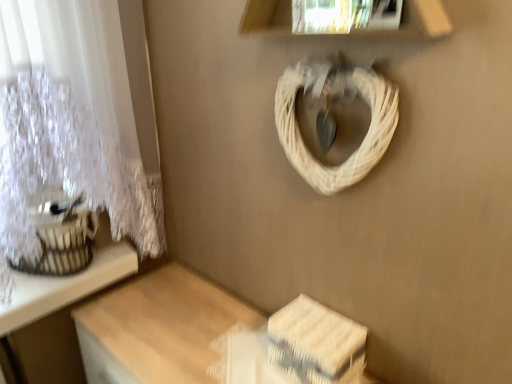
What do you see at coordinates (77, 121) in the screenshot? I see `white lace curtain at upper left` at bounding box center [77, 121].

Where is `wooden table at lower right`? This screenshot has width=512, height=384. wooden table at lower right is located at coordinates (158, 328).

This screenshot has height=384, width=512. What do you see at coordinates (158, 328) in the screenshot?
I see `wooden table at lower right` at bounding box center [158, 328].

Locate an element on the screen. This screenshot has height=384, width=512. white woven storage box at lower right is located at coordinates (316, 343).

I want to click on table to the right of white lace curtain at upper left, so click(158, 328).

How far apart are white lace curtain at upper left and wooden table at lower right?

white lace curtain at upper left is 37.15 centimeters from wooden table at lower right.

Is white lace curtain at upper left touching wooden table at lower right?

white lace curtain at upper left and wooden table at lower right are not in contact.

Can you tell me how much white lace curtain at upper left and wooden table at lower right differ in facing direction?

They differ by 91.7 degrees in their facing directions.

Is white lace curtain at upper left facing towards white woven storage box at lower right?

Yes, white lace curtain at upper left is turned towards white woven storage box at lower right.

Is white lace curtain at upper left not close to white woven storage box at lower right?

No.

Which is behind, white lace curtain at upper left or white woven storage box at lower right?

Positioned behind is white woven storage box at lower right.

Considering the sizes of objects white lace curtain at upper left and white woven storage box at lower right in the image provided, who is taller, white lace curtain at upper left or white woven storage box at lower right?

white lace curtain at upper left.

Is white wicker basket at upper center positioned far away from white lace curtain at upper left?

They are positioned close to each other.

Based on the photo, from the image's perspective, is white wicker basket at upper center on top of white lace curtain at upper left?

Yes, from the image's perspective, white wicker basket at upper center is above white lace curtain at upper left.

Where is `curtain on the left of white wicker basket at upper center`? This screenshot has height=384, width=512. curtain on the left of white wicker basket at upper center is located at coordinates (77, 121).

Considering the relative sizes of white wicker basket at upper center and white lace curtain at upper left in the image provided, is white wicker basket at upper center taller than white lace curtain at upper left?

Incorrect, the height of white wicker basket at upper center is not larger of that of white lace curtain at upper left.

Considering the sizes of objects white lace curtain at upper left and white wicker basket at upper center in the image provided, who is shorter, white lace curtain at upper left or white wicker basket at upper center?

white wicker basket at upper center is shorter.

Is the position of white lace curtain at upper left less distant than that of white wicker basket at upper center?

Yes, white lace curtain at upper left is in front of white wicker basket at upper center.

Considering the points (50, 92) and (376, 145), which point is in front, point (50, 92) or point (376, 145)?

The point (376, 145) is in front.

Considering the positions of objects white lace curtain at upper left and white wicker basket at upper center in the image provided, who is more to the right, white lace curtain at upper left or white wicker basket at upper center?

From the viewer's perspective, white wicker basket at upper center appears more on the right side.

Between wooden table at lower right and white woven storage box at lower right, which one appears on the right side from the viewer's perspective?

white woven storage box at lower right is more to the right.

Are wooden table at lower right and white woven storage box at lower right beside each other?

wooden table at lower right is not next to white woven storage box at lower right, and they're not touching.

From a real-world perspective, does wooden table at lower right stand above white woven storage box at lower right?

No, from a real-world perspective, wooden table at lower right is not over white woven storage box at lower right

From the image's perspective, is wooden table at lower right located beneath white woven storage box at lower right?

Indeed, from the image's perspective, wooden table at lower right is shown beneath white woven storage box at lower right.

Is white wicker basket at upper center in front of or behind wooden table at lower right in the image?

white wicker basket at upper center is positioned closer to the viewer than wooden table at lower right.

Can you confirm if white wicker basket at upper center is wider than wooden table at lower right?

In fact, white wicker basket at upper center might be narrower than wooden table at lower right.

Image resolution: width=512 pixels, height=384 pixels. I want to click on table below the white wicker basket at upper center (from a real-world perspective), so 158,328.

Considering the sizes of white wicker basket at upper center and white woven storage box at lower right in the image, is white wicker basket at upper center bigger or smaller than white woven storage box at lower right?

In the image, white wicker basket at upper center appears to be larger than white woven storage box at lower right.

Which object is more forward, white wicker basket at upper center or white woven storage box at lower right?

white wicker basket at upper center is in front.

Is white wicker basket at upper center located outside white woven storage box at lower right?

That's correct, white wicker basket at upper center is outside of white woven storage box at lower right.

Image resolution: width=512 pixels, height=384 pixels. Identify the location of table behind the white lace curtain at upper left. (158, 328).

Where is `curtain above the white woven storage box at lower right (from a real-world perspective)`? curtain above the white woven storage box at lower right (from a real-world perspective) is located at coordinates (77, 121).

Estimate the real-world distances between objects in this image. Which object is further from white woven storage box at lower right, white lace curtain at upper left or wooden table at lower right?

Based on the image, white lace curtain at upper left appears to be further to white woven storage box at lower right.

Looking at the image, which one is located further to wooden table at lower right, white wicker basket at upper center or white woven storage box at lower right?

Based on the image, white wicker basket at upper center appears to be further to wooden table at lower right.

Based on their spatial positions, is wooden table at lower right or white wicker basket at upper center further from white lace curtain at upper left?

Among the two, white wicker basket at upper center is located further to white lace curtain at upper left.

From the image, which object appears to be farther from wooden table at lower right, white lace curtain at upper left or white wicker basket at upper center?

white wicker basket at upper center is positioned further to the anchor wooden table at lower right.

Estimate the real-world distances between objects in this image. Which object is further from wooden table at lower right, white woven storage box at lower right or white lace curtain at upper left?

white lace curtain at upper left lies further to wooden table at lower right than the other object.

Considering their positions, is white lace curtain at upper left positioned further to white woven storage box at lower right than white wicker basket at upper center?

white lace curtain at upper left.

Which object lies nearer to the anchor point white lace curtain at upper left, white woven storage box at lower right or wooden table at lower right?

wooden table at lower right is closer to white lace curtain at upper left.

Looking at the image, which one is located closer to wooden table at lower right, white woven storage box at lower right or white wicker basket at upper center?

white woven storage box at lower right is positioned closer to the anchor wooden table at lower right.

The width and height of the screenshot is (512, 384). I want to click on storage box between white lace curtain at upper left and wooden table at lower right in the up-down direction, so click(316, 343).

The image size is (512, 384). In order to click on storage box between white wicker basket at upper center and wooden table at lower right in the up-down direction in this screenshot , I will do `click(316, 343)`.

Where is `curtain that lies between white wicker basket at upper center and wooden table at lower right from top to bottom`? Image resolution: width=512 pixels, height=384 pixels. curtain that lies between white wicker basket at upper center and wooden table at lower right from top to bottom is located at coordinates (77, 121).

Where is `storage box situated between white lace curtain at upper left and white wicker basket at upper center from left to right`? storage box situated between white lace curtain at upper left and white wicker basket at upper center from left to right is located at coordinates (316, 343).